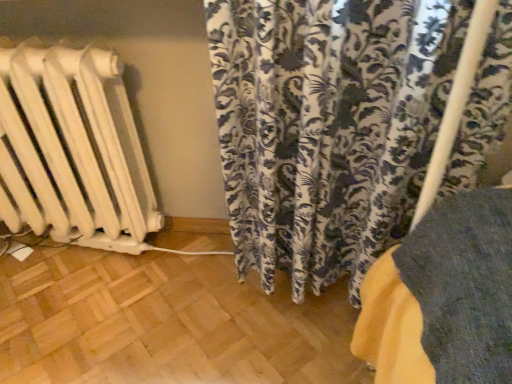
Measure the distance between point (30, 127) and camera.

A distance of 1.01 meters exists between point (30, 127) and camera.

What do you see at coordinates (72, 150) in the screenshot? I see `white matte radiator at left` at bounding box center [72, 150].

The height and width of the screenshot is (384, 512). I want to click on white matte radiator at left, so pos(72,150).

Find the location of `white matte radiator at left`. white matte radiator at left is located at coordinates (72, 150).